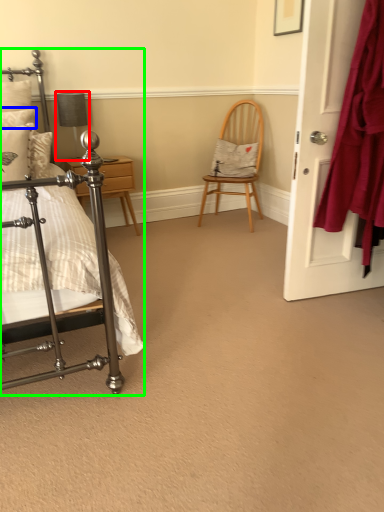
Question: Which object is positioned farthest from table lamp (highlighted by a red box)? Select from pillow (highlighted by a blue box) and bed (highlighted by a green box).

Choices:
 (A) pillow
 (B) bed

Answer: (B)